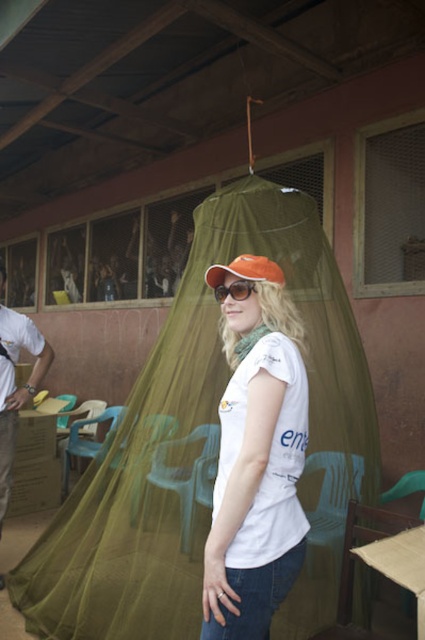
Question: Can you confirm if white matte t-shirt at center is thinner than sunglassestransparent at center?

Choices:
 (A) no
 (B) yes

Answer: (A)

Question: Which of the following is the closest to the observer?

Choices:
 (A) orange fabric cap at center
 (B) sunglassestransparent at center
 (C) white cardboard box at left
 (D) white matte t-shirt at center

Answer: (D)

Question: Can you confirm if white cardboard box at left is smaller than sunglassestransparent at center?

Choices:
 (A) yes
 (B) no

Answer: (B)

Question: Among these objects, which one is farthest from the camera?

Choices:
 (A) orange fabric cap at center
 (B) white cardboard box at left
 (C) sunglassestransparent at center

Answer: (B)

Question: Which object is the closest to the white cardboard box at left?

Choices:
 (A) white matte t-shirt at center
 (B) sunglassestransparent at center

Answer: (A)

Question: Is white cardboard box at left closer to the viewer compared to orange fabric cap at center?

Choices:
 (A) no
 (B) yes

Answer: (A)